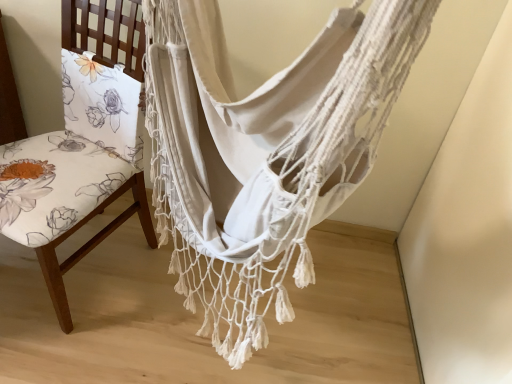
Identify the location of free point below floral fabric chair at left (from a real-world perspective). The height and width of the screenshot is (384, 512). (76, 270).